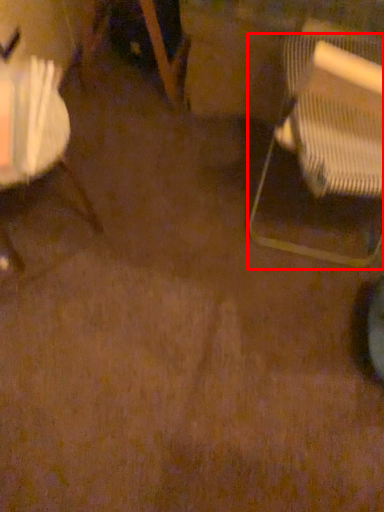
Question: From the image's perspective, considering the relative positions of chair (annotated by the red box) and chair in the image provided, where is chair (annotated by the red box) located with respect to the staircase?

Choices:
 (A) below
 (B) above

Answer: (B)